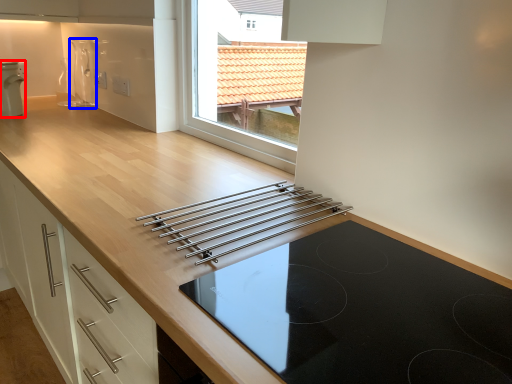
Question: Among these objects, which one is farthest to the camera, home appliance (highlighted by a red box) or appliance (highlighted by a blue box)?

Choices:
 (A) home appliance
 (B) appliance

Answer: (B)